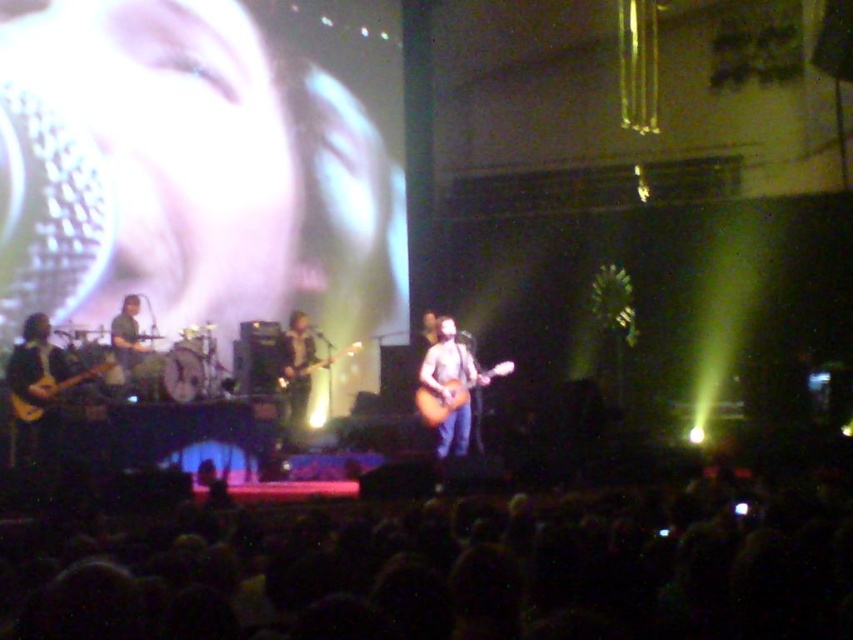
You are a stagehand who needs to move the acoustic wood guitar at center and the light brown wood electric guitar at left to the storage room. The storage room has a narrow doorway that is 6 meters wide. Can you carry both guitars through the doorway at the same time without tilting them sideways?

The acoustic wood guitar at center and the light brown wood electric guitar at left are 6.59 meters apart. Since the distance between them is greater than the doorway width of 6 meters, you cannot carry both guitars through the doorway simultaneously without tilting them sideways.